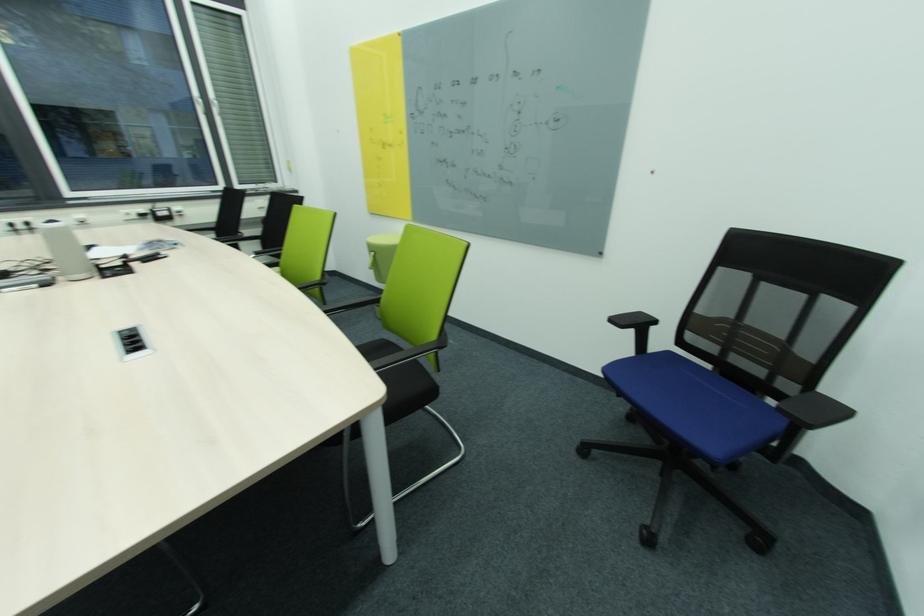
Find where to sit the blue chair sitting surface. Please return your answer as a coordinate pair (x, y).

(815, 410)